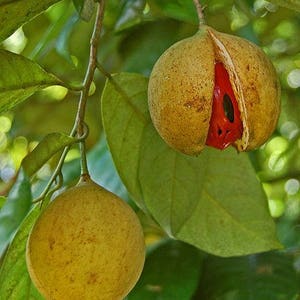
You are a GUI agent. You are given a task and a screenshot of the screen. Output one action in this format:
    pyautogui.click(x=<x>, y=<y>)
    Task: Click on the 2 groups of plants
    
    Given the screenshot: What is the action you would take?
    tap(180, 286), tap(174, 194)